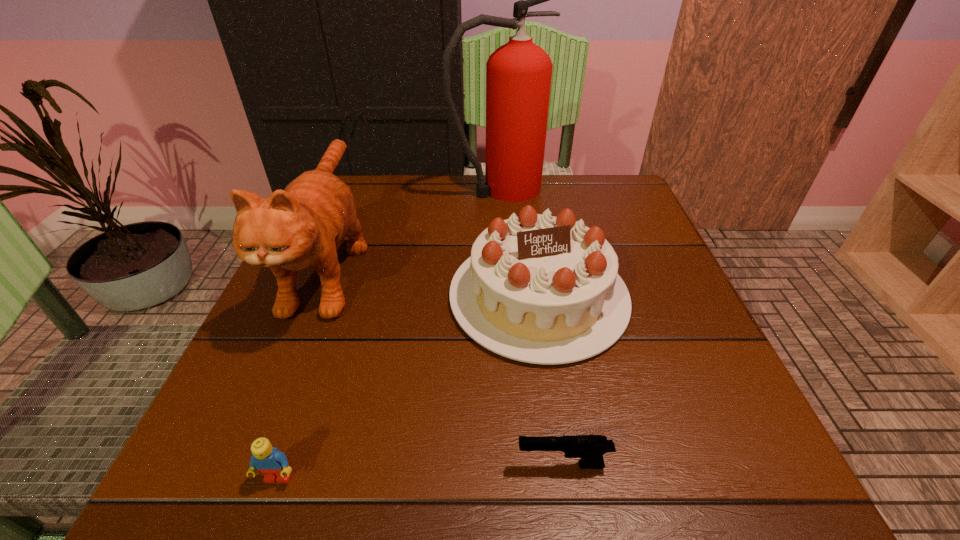
You are a GUI agent. You are given a task and a screenshot of the screen. Output one action in this format:
    pyautogui.click(x=<x>, y=<y>)
    Task: Click on the tallest object
    The height and width of the screenshot is (540, 960).
    Given the screenshot: What is the action you would take?
    pyautogui.click(x=518, y=74)

Find the location of `fire extinguisher`. fire extinguisher is located at coordinates (518, 74).

I want to click on the second tallest object, so 302,226.

Locate an element on the screen. The width and height of the screenshot is (960, 540). birthday cake is located at coordinates (539, 289).

Locate an element on the screen. This screenshot has width=960, height=540. the fourth tallest object is located at coordinates (273, 464).

Locate an element on the screen. pistol is located at coordinates (590, 448).

Where is `vacant space located 0.170m on the handle side of the tallest object`? The height and width of the screenshot is (540, 960). vacant space located 0.170m on the handle side of the tallest object is located at coordinates (612, 189).

Where is `free space located 0.170m on the face of the cat`? free space located 0.170m on the face of the cat is located at coordinates (258, 441).

Locate an element on the screen. This screenshot has height=540, width=960. vacant space located on the back of the third shortest object is located at coordinates (524, 199).

Where is `vacant region located 0.120m on the front-facing side of the shortest object`? The height and width of the screenshot is (540, 960). vacant region located 0.120m on the front-facing side of the shortest object is located at coordinates (427, 465).